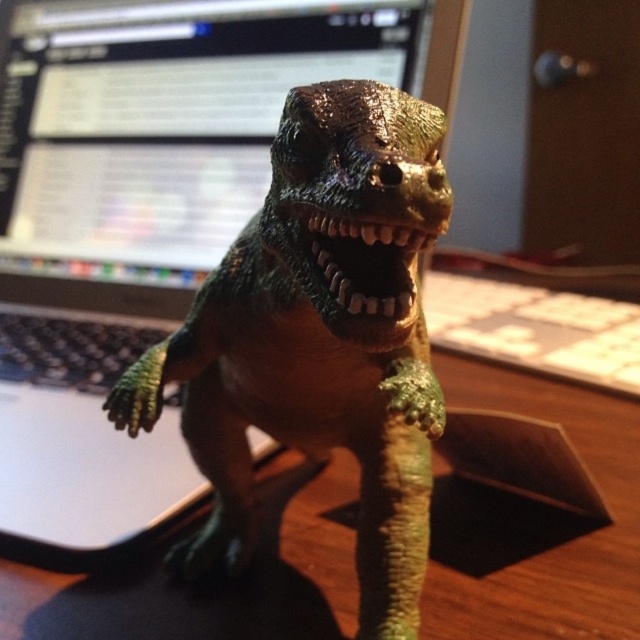
Is point (365, 234) behind point (179, 316)?

That is False.

The width and height of the screenshot is (640, 640). I want to click on shiny plastic dinosaur at center, so [x=320, y=337].

Is point (502, 496) in front of point (461, 35)?

Yes, it is.

Is wooden desk at center wider than matte black monitor at upper center?

Yes.

I want to click on wooden desk at center, so click(x=536, y=518).

Is shiny plastic dinosaur at center below wooden desk at center?

Actually, shiny plastic dinosaur at center is above wooden desk at center.

Between shiny plastic dinosaur at center and wooden desk at center, which one has more height?

shiny plastic dinosaur at center

Locate an element on the screen. The height and width of the screenshot is (640, 640). shiny plastic dinosaur at center is located at coordinates (320, 337).